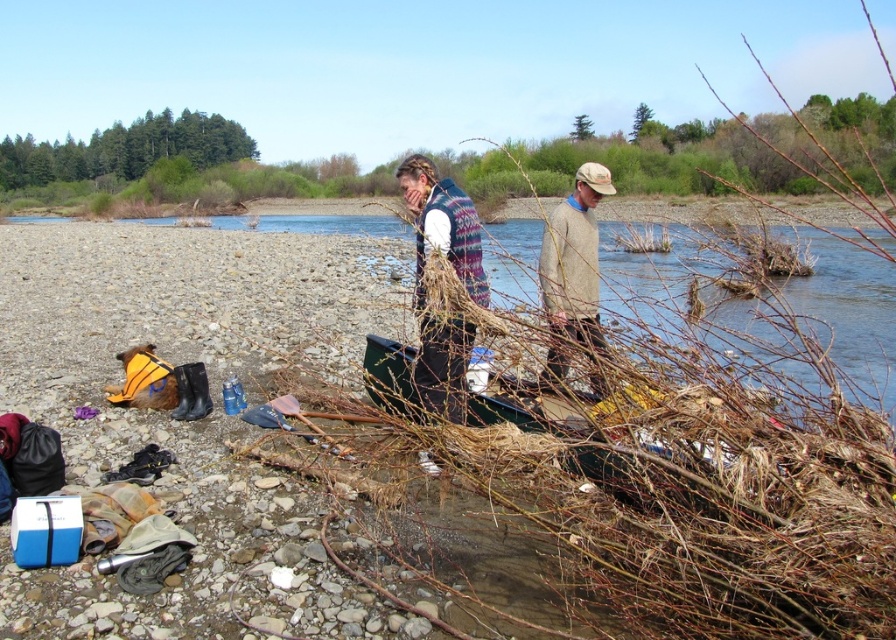
Question: Which point is closer to the camera?

Choices:
 (A) (438, 372)
 (B) (476, 225)
 (C) (595, 380)

Answer: (C)

Question: Does knitted wool sweater at center appear on the left side of light brown sweater at center?

Choices:
 (A) no
 (B) yes

Answer: (B)

Question: Estimate the real-world distances between objects in this image. Which object is farther from the knitted sweater at center?

Choices:
 (A) green plastic canoe at center
 (B) knitted wool sweater at center

Answer: (A)

Question: Which point is farther to the camera?

Choices:
 (A) (556, 269)
 (B) (588, 451)
 (C) (452, 333)

Answer: (A)

Question: Can you confirm if knitted sweater at center is positioned below knitted wool sweater at center?

Choices:
 (A) no
 (B) yes

Answer: (B)

Question: Is knitted sweater at center bigger than light brown sweater at center?

Choices:
 (A) yes
 (B) no

Answer: (A)